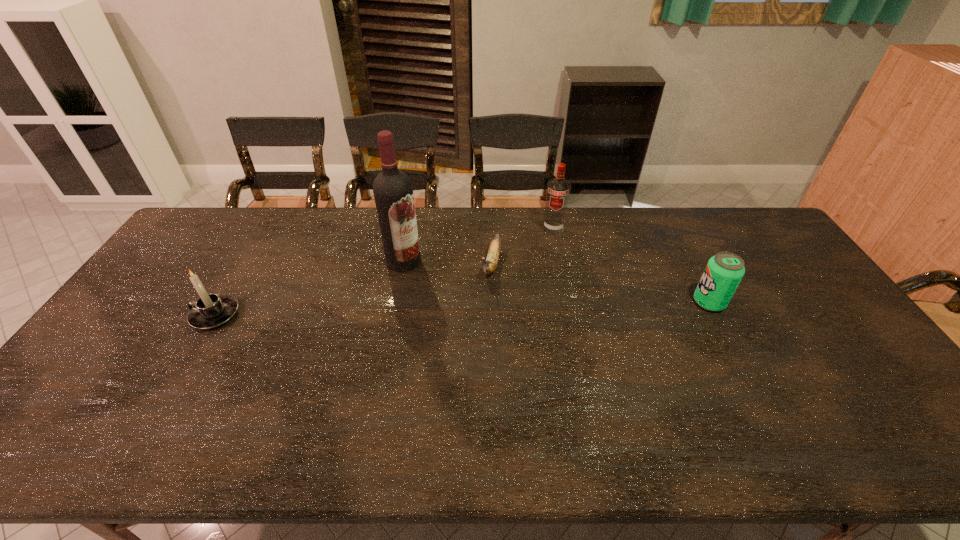
Find the location of a particular element. The height and width of the screenshot is (540, 960). vacant space located 0.080m with a handle on the side of the leftmost object is located at coordinates (164, 315).

Image resolution: width=960 pixels, height=540 pixels. I want to click on vacant space situated on the front-facing side of the pop soda, so click(559, 302).

Locate an element on the screen. vacant area located on the front-facing side of the pop soda is located at coordinates (653, 302).

Locate an element on the screen. free spot located 0.200m on the front-facing side of the pop soda is located at coordinates (626, 302).

Image resolution: width=960 pixels, height=540 pixels. Find the location of `vacant space located on the label of the wine bottle`. vacant space located on the label of the wine bottle is located at coordinates (473, 358).

Where is `vacant region located 0.070m on the label of the wine bottle`? vacant region located 0.070m on the label of the wine bottle is located at coordinates (420, 284).

Where is `vacant position located 0.120m on the label of the wine bottle`? vacant position located 0.120m on the label of the wine bottle is located at coordinates (427, 294).

Where is `free location located 0.170m on the front label of the farthest object`? free location located 0.170m on the front label of the farthest object is located at coordinates (545, 266).

This screenshot has width=960, height=540. I want to click on vacant space located 0.280m on the front label of the farthest object, so click(x=540, y=289).

The image size is (960, 540). I want to click on vacant space situated on the front label of the farthest object, so click(540, 296).